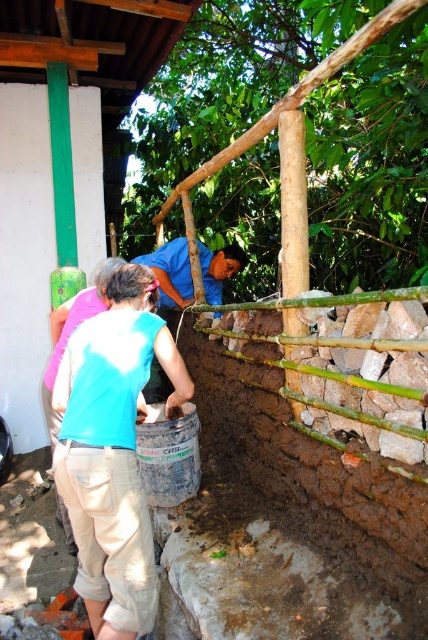
Question: Is matte blue shirt at center wider than khaki pants at lower left?

Choices:
 (A) yes
 (B) no

Answer: (B)

Question: Which point is farther to the camera?

Choices:
 (A) (88, 566)
 (B) (74, 305)
 (C) (208, 280)

Answer: (C)

Question: Does blue shirt at center have a smaller size compared to khaki pants at lower left?

Choices:
 (A) yes
 (B) no

Answer: (A)

Question: In this image, where is blue shirt at center located relative to khaki pants at lower left?

Choices:
 (A) left
 (B) right

Answer: (B)

Question: Which point is closer to the camera?

Choices:
 (A) (41, 380)
 (B) (189, 301)

Answer: (B)

Question: Which point is closer to the camera?

Choices:
 (A) (118, 316)
 (B) (152, 374)
 (C) (67, 326)

Answer: (A)